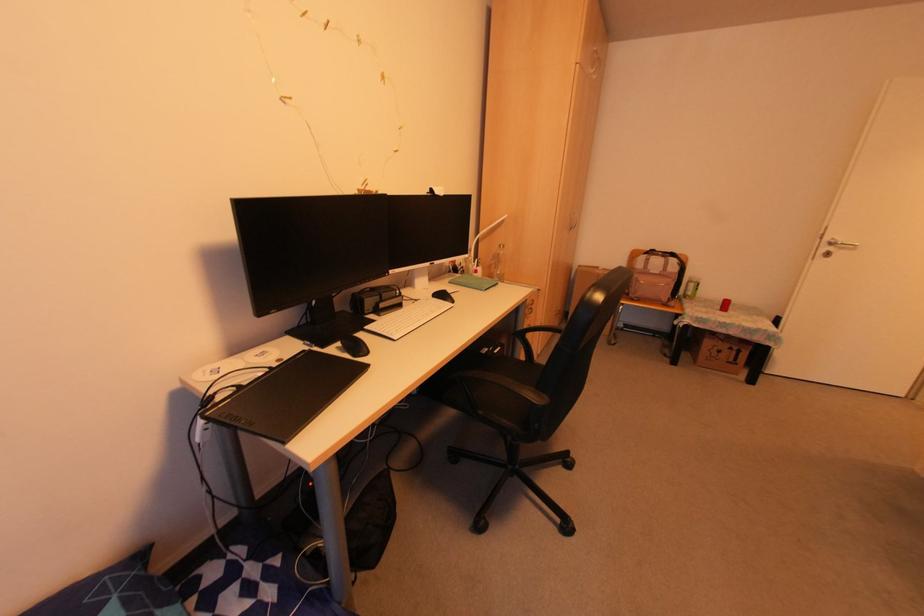
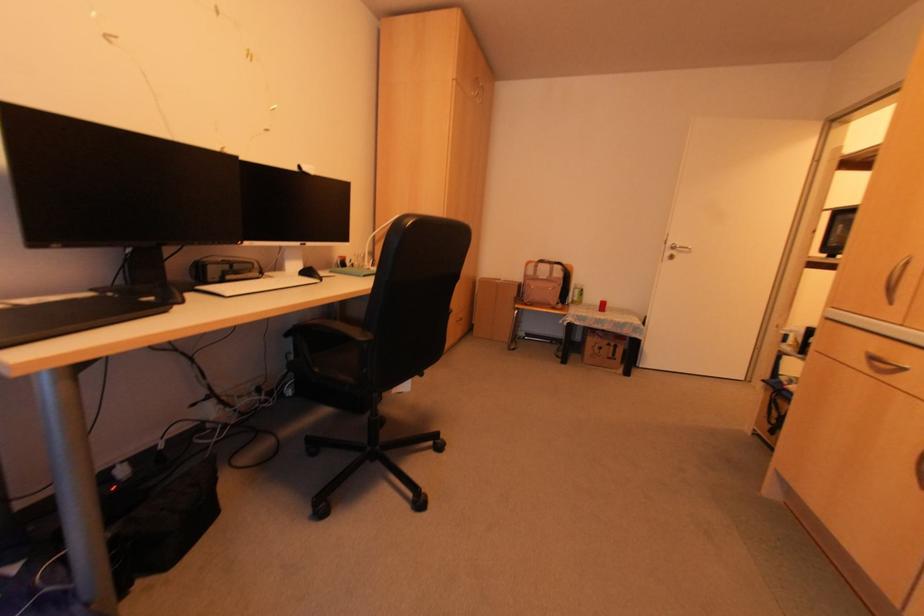
Question: The camera is either moving clockwise (left) or counter-clockwise (right) around the object. The first image is from the beginning of the video and the second image is from the end. Is the camera moving left or right when shooting the video?

Choices:
 (A) Left
 (B) Right

Answer: (A)